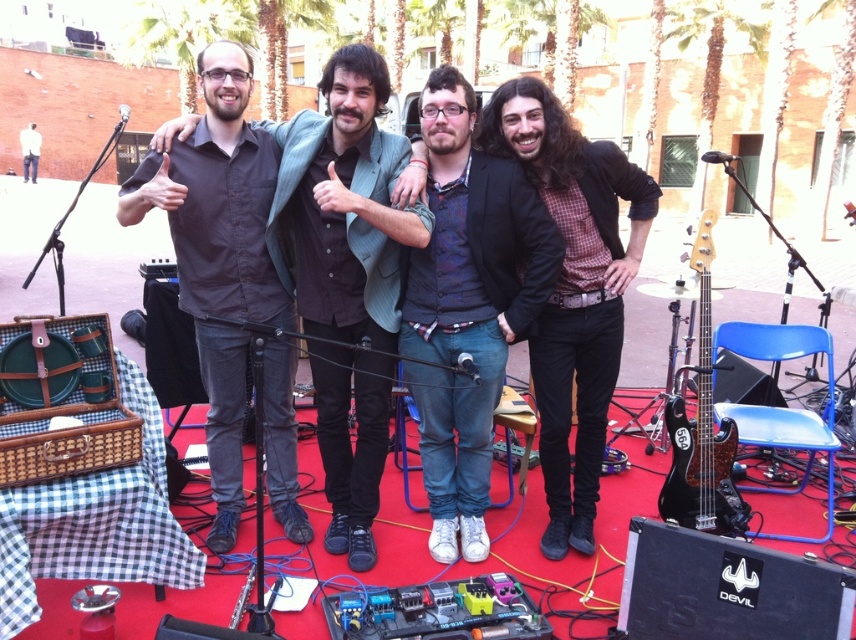
In the scene shown: You are a photographer at the scene and want to take a photo that includes both the matte black shirt at center and the black glossy bass guitar at right. Which object should be placed on the right side of the photo to ensure both are visible?

The black glossy bass guitar at right should be placed on the right side of the photo because the matte black shirt at center is to the left of it, ensuring both are visible in the frame.

You are a photographer adjusting your camera settings to capture the band members. You notice the matte black shirt at center and the denim jeans at center. Which clothing item appears wider in the photo?

The matte black shirt at center appears wider than the denim jeans at center because its width surpasses that of the denim jeans at center.